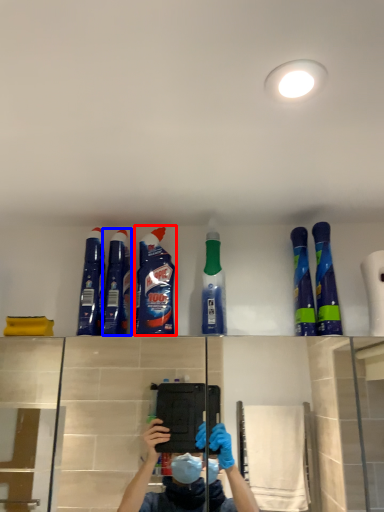
Question: Which of the following is the farthest to the observer, cleaning product (highlighted by a red box) or cleaning product (highlighted by a blue box)?

Choices:
 (A) cleaning product
 (B) cleaning product

Answer: (A)